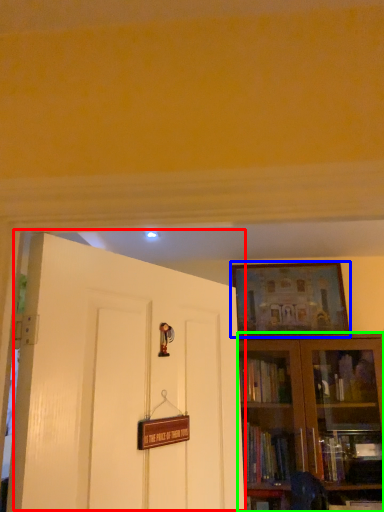
Question: Which object is the farthest from door (highlighted by a red box)? Choose among these: picture frame (highlighted by a blue box) or bookcase (highlighted by a green box).

Choices:
 (A) picture frame
 (B) bookcase

Answer: (A)